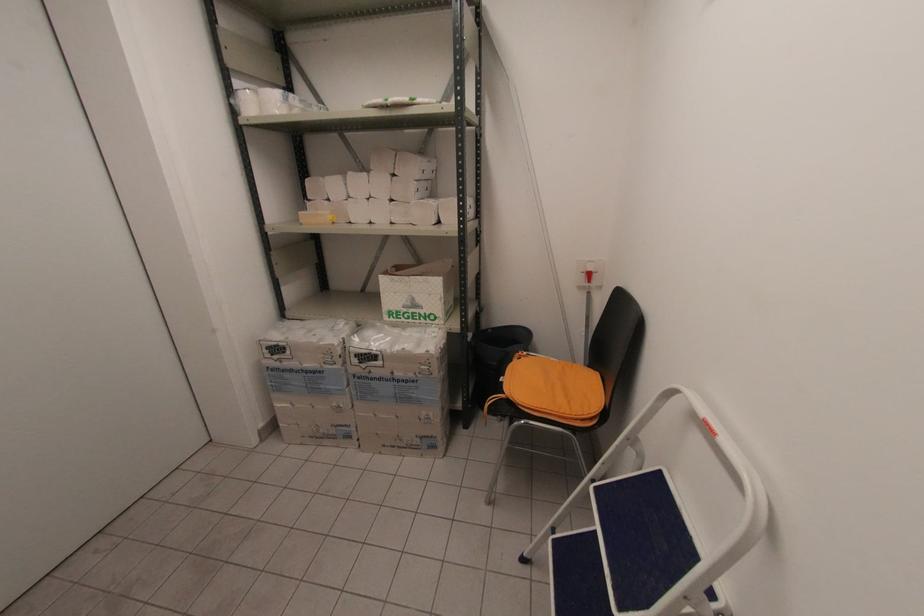
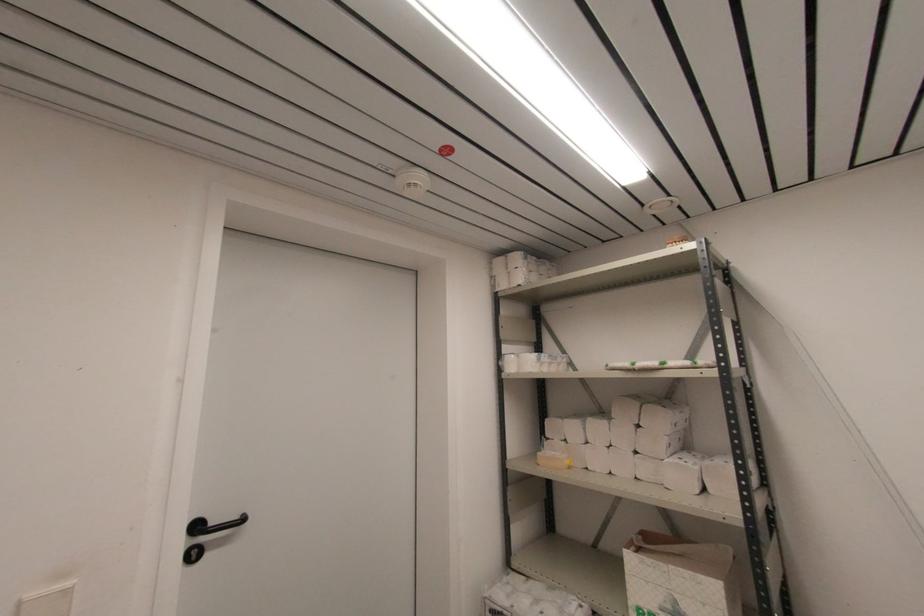
Find the pixel in the second image that matches (x=392, y=200) in the first image.

(637, 453)